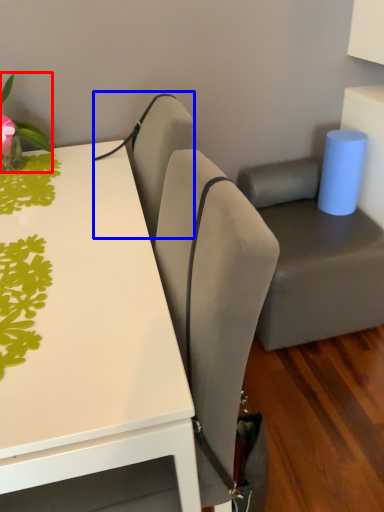
Question: Which object appears closest to the camera in this image, plant (highlighted by a red box) or armchair (highlighted by a blue box)?

Choices:
 (A) plant
 (B) armchair

Answer: (A)